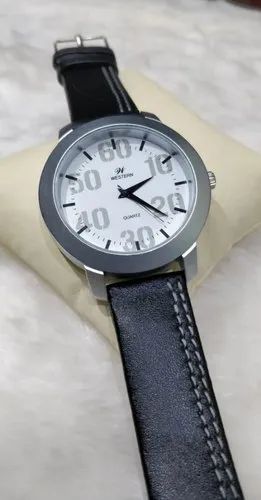
Locate an element on the screen. The width and height of the screenshot is (261, 500). silver knob is located at coordinates (213, 180).